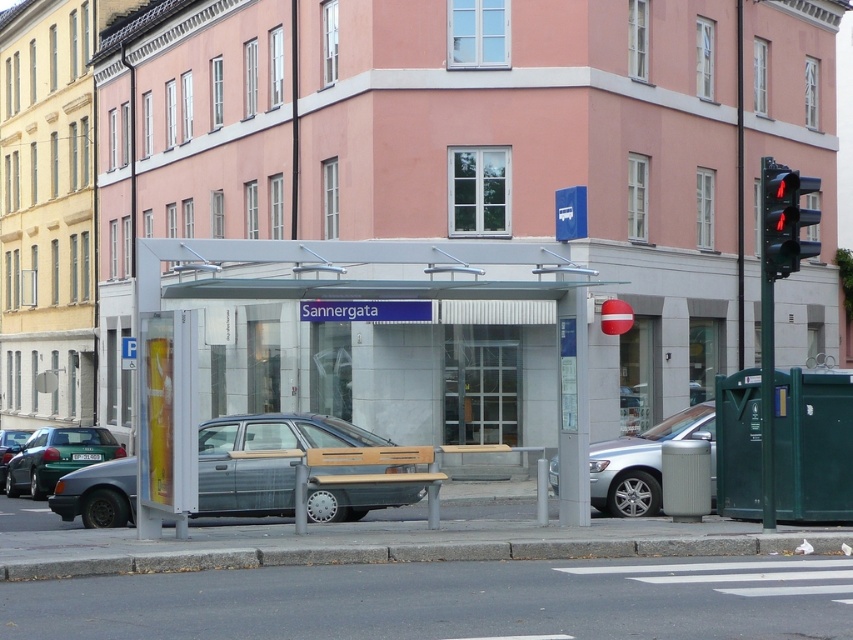
Question: Is metallic silver bus stop at center positioned in front of green plastic phone box at lower right?

Choices:
 (A) yes
 (B) no

Answer: (A)

Question: Which of the following is the farthest from the observer?

Choices:
 (A) black glass traffic light at upper right
 (B) gray concrete curb at lower center
 (C) metallic silver bus stop at center
 (D) shiny black sedan at lower left

Answer: (D)

Question: Does green plastic phone box at lower right appear under gray concrete curb at lower center?

Choices:
 (A) no
 (B) yes

Answer: (A)

Question: Which of the following is the closest to the observer?

Choices:
 (A) (630, 483)
 (B) (107, 451)
 (C) (805, 420)

Answer: (C)

Question: Can you confirm if green plastic phone box at lower right is positioned to the right of matte gray sedan at lower left?

Choices:
 (A) yes
 (B) no

Answer: (A)

Question: Which point is farther to the camera?

Choices:
 (A) metallic silver bus stop at center
 (B) matte gray sedan at lower left
 (C) shiny black sedan at lower left

Answer: (B)